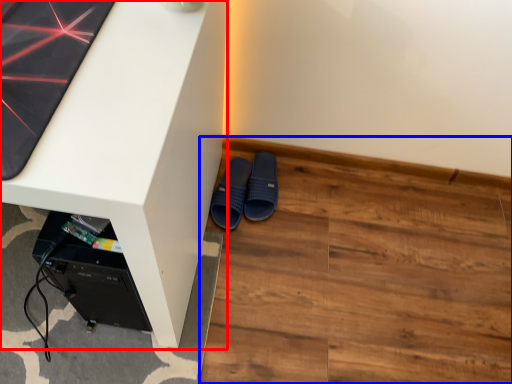
Question: Which object appears farthest to the camera in this image, desk (highlighted by a red box) or hardwood (highlighted by a blue box)?

Choices:
 (A) desk
 (B) hardwood

Answer: (B)